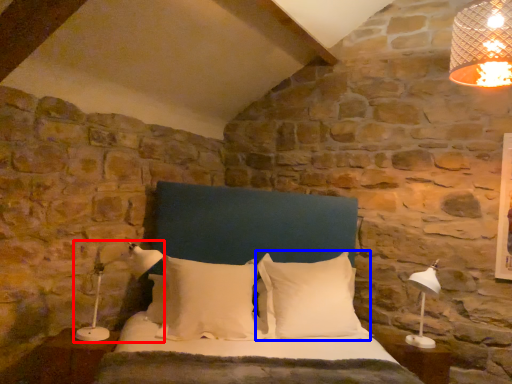
Question: Among these objects, which one is farthest to the camera, lamp (highlighted by a red box) or pillow (highlighted by a blue box)?

Choices:
 (A) lamp
 (B) pillow

Answer: (B)